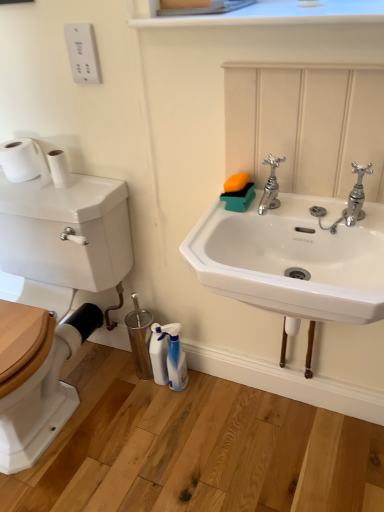
Locate an element on the screen. The width and height of the screenshot is (384, 512). white matte toilet paper at left, positioned as the second toilet paper in left-to-right order is located at coordinates (59, 168).

What do you see at coordinates (59, 168) in the screenshot? The width and height of the screenshot is (384, 512). I see `white matte toilet paper at left, the 1th toilet paper in the right-to-left sequence` at bounding box center [59, 168].

The width and height of the screenshot is (384, 512). What do you see at coordinates (175, 357) in the screenshot?
I see `white glossy spray bottle at lower center, the 1th cleaning product viewed from the right` at bounding box center [175, 357].

What do you see at coordinates (67, 233) in the screenshot? I see `white glossy toilet tank at left` at bounding box center [67, 233].

You are a GUI agent. You are given a task and a screenshot of the screen. Output one action in this format:
    pyautogui.click(x=<x>, y=<y>)
    Task: Click on the white glossy toilet tank at left
    The width and height of the screenshot is (384, 512).
    Given the screenshot: What is the action you would take?
    pyautogui.click(x=67, y=233)

This screenshot has width=384, height=512. What are the coordinates of `white matte toilet paper at left, positioned as the second toilet paper in left-to-right order` in the screenshot? It's located at (59, 168).

From the image's perspective, between white glossy toilet tank at left and chrome metallic faucet at upper right, which appears as the second tap when viewed from the left, which one is located above?

chrome metallic faucet at upper right, which appears as the second tap when viewed from the left, from the image's perspective.

Looking at this image, is white glossy toilet tank at left located outside chrome metallic faucet at upper right, which appears as the second tap when viewed from the left?

Absolutely, white glossy toilet tank at left is external to chrome metallic faucet at upper right, which appears as the second tap when viewed from the left.

Considering the positions of points (102, 251) and (360, 205), is point (102, 251) closer to camera compared to point (360, 205)?

No, (102, 251) is further to viewer.

This screenshot has height=512, width=384. Find the location of `the 1st tap above the white glossy toilet tank at left (from the image's perspective)`. the 1st tap above the white glossy toilet tank at left (from the image's perspective) is located at coordinates (x=354, y=198).

From the picture: Considering the sizes of objects chrome metallic faucet at upper center, the first tap when ordered from left to right, and chrome metallic faucet at upper right, which appears as the second tap when viewed from the left, in the image provided, who is smaller, chrome metallic faucet at upper center, the first tap when ordered from left to right, or chrome metallic faucet at upper right, which appears as the second tap when viewed from the left,?

With smaller size is chrome metallic faucet at upper right, which appears as the second tap when viewed from the left.

Which is closer to the camera, (276, 162) or (347, 214)?

Point (276, 162) is closer to the camera than point (347, 214).

This screenshot has width=384, height=512. I want to click on tap that appears in front of the chrome metallic faucet at upper center, the second tap viewed from the right, so click(x=354, y=198).

Is chrome metallic faucet at upper center, the second tap viewed from the right, next to chrome metallic faucet at upper right, which appears as the second tap when viewed from the left?

No, chrome metallic faucet at upper center, the second tap viewed from the right, is not beside chrome metallic faucet at upper right, which appears as the second tap when viewed from the left.

How much distance is there between white matte toilet paper at left, the 1th toilet paper viewed from the left, and white ceramic sink at center?

white matte toilet paper at left, the 1th toilet paper viewed from the left, and white ceramic sink at center are 32.39 inches apart.

What's the angular difference between white matte toilet paper at left, which is counted as the 2th toilet paper, starting from the right, and white ceramic sink at center's facing directions?

The facing directions of white matte toilet paper at left, which is counted as the 2th toilet paper, starting from the right, and white ceramic sink at center are 0.298 degrees apart.

From the image's perspective, which one is positioned higher, white matte toilet paper at left, the 1th toilet paper viewed from the left, or white ceramic sink at center?

From the image's view, white matte toilet paper at left, the 1th toilet paper viewed from the left, is above.

Image resolution: width=384 pixels, height=512 pixels. What are the coordinates of `sink in front of the white matte toilet paper at left, the 1th toilet paper viewed from the left` in the screenshot? It's located at (293, 257).

Which is behind, point (243, 17) or point (270, 234)?

The point (270, 234) is farther from the camera.

In terms of size, does white smooth window sill at upper center appear bigger or smaller than white ceramic sink at center?

Considering their sizes, white smooth window sill at upper center takes up less space than white ceramic sink at center.

In the scene shown: From a real-world perspective, is white smooth window sill at upper center on top of white ceramic sink at center?

Yes, from a real-world perspective, white smooth window sill at upper center is on top of white ceramic sink at center.

How many degrees apart are the facing directions of white glossy spray bottle at lower center, the 1th cleaning product viewed from the right, and white matte toilet paper at left, the 1th toilet paper in the right-to-left sequence?

There is a 46.4-degree angle between the facing directions of white glossy spray bottle at lower center, the 1th cleaning product viewed from the right, and white matte toilet paper at left, the 1th toilet paper in the right-to-left sequence.

Which of these two, white glossy spray bottle at lower center, which is the 2th cleaning product in left-to-right order, or white matte toilet paper at left, the 1th toilet paper in the right-to-left sequence, stands shorter?

With less height is white matte toilet paper at left, the 1th toilet paper in the right-to-left sequence.

You are a GUI agent. You are given a task and a screenshot of the screen. Output one action in this format:
    pyautogui.click(x=<x>, y=<y>)
    Task: Click on the 1st toilet paper above the white glossy spray bottle at lower center, which is the 2th cleaning product in left-to-right order (from the image's perspective)
    The width and height of the screenshot is (384, 512).
    Given the screenshot: What is the action you would take?
    pyautogui.click(x=59, y=168)

Is white glossy spray bottle at lower center, which is the 2th cleaning product in left-to-right order, aimed at white matte toilet paper at left, positioned as the second toilet paper in left-to-right order?

No, white glossy spray bottle at lower center, which is the 2th cleaning product in left-to-right order, is not facing towards white matte toilet paper at left, positioned as the second toilet paper in left-to-right order.

From a real-world perspective, is white matte toilet paper at left, positioned as the second toilet paper in left-to-right order, above or below white glossy toilet tank at left?

Clearly, from a real-world perspective, white matte toilet paper at left, positioned as the second toilet paper in left-to-right order, is above white glossy toilet tank at left.

Considering the sizes of objects white matte toilet paper at left, the 1th toilet paper in the right-to-left sequence, and white glossy toilet tank at left in the image provided, who is taller, white matte toilet paper at left, the 1th toilet paper in the right-to-left sequence, or white glossy toilet tank at left?

Standing taller between the two is white glossy toilet tank at left.

From the image's perspective, is white matte toilet paper at left, the 1th toilet paper in the right-to-left sequence, positioned above or below white glossy toilet tank at left?

Clearly, from the image's perspective, white matte toilet paper at left, the 1th toilet paper in the right-to-left sequence, is above white glossy toilet tank at left.

Considering the positions of objects white matte toilet paper at left, the 1th toilet paper in the right-to-left sequence, and white glossy toilet tank at left in the image provided, who is more to the right, white matte toilet paper at left, the 1th toilet paper in the right-to-left sequence, or white glossy toilet tank at left?

Positioned to the right is white matte toilet paper at left, the 1th toilet paper in the right-to-left sequence.

Considering the sizes of white smooth window sill at upper center and white matte toilet paper at left, positioned as the second toilet paper in left-to-right order, in the image, is white smooth window sill at upper center wider or thinner than white matte toilet paper at left, positioned as the second toilet paper in left-to-right order,?

Considering their sizes, white smooth window sill at upper center looks broader than white matte toilet paper at left, positioned as the second toilet paper in left-to-right order.

From a real-world perspective, relative to white matte toilet paper at left, positioned as the second toilet paper in left-to-right order, is white smooth window sill at upper center vertically above or below?

white smooth window sill at upper center is situated higher than white matte toilet paper at left, positioned as the second toilet paper in left-to-right order, in the real world.

Considering the relative positions of white smooth window sill at upper center and white matte toilet paper at left, the 1th toilet paper in the right-to-left sequence, in the image provided, is white smooth window sill at upper center to the left of white matte toilet paper at left, the 1th toilet paper in the right-to-left sequence, from the viewer's perspective?

In fact, white smooth window sill at upper center is to the right of white matte toilet paper at left, the 1th toilet paper in the right-to-left sequence.

Considering the points (157, 22) and (53, 157), which point is in front, point (157, 22) or point (53, 157)?

Point (157, 22)

This screenshot has height=512, width=384. What are the coordinates of `the 2nd tap counting from the right side of the white glossy toilet tank at left` in the screenshot? It's located at (354, 198).

The image size is (384, 512). What are the coordinates of `tap located in front of the chrome metallic faucet at upper center, the first tap when ordered from left to right` in the screenshot? It's located at (354, 198).

Considering their positions, is white glossy spray bottle at lower center, the 1th cleaning product viewed from the right, positioned further to chrome metallic faucet at upper center, the second tap viewed from the right, than white matte toilet paper at left, the 1th toilet paper in the right-to-left sequence?

white glossy spray bottle at lower center, the 1th cleaning product viewed from the right.

Based on their spatial positions, is white glossy spray bottle at lower center, which is the 2th cleaning product in left-to-right order, or white matte toilet paper at left, positioned as the second toilet paper in left-to-right order, closer to white ceramic sink at center?

Based on the image, white matte toilet paper at left, positioned as the second toilet paper in left-to-right order, appears to be nearer to white ceramic sink at center.

Estimate the real-world distances between objects in this image. Which object is further from chrome metallic faucet at upper center, the second tap viewed from the right, chrome metallic faucet at upper right, which appears as the second tap when viewed from the left, or white ceramic sink at center?

white ceramic sink at center is positioned further to the anchor chrome metallic faucet at upper center, the second tap viewed from the right.

From the image, which object appears to be farther from white smooth window sill at upper center, white matte toilet paper at left, the 1th toilet paper in the right-to-left sequence, or chrome metallic faucet at upper right, which ranks as the first tap in right-to-left order?

white matte toilet paper at left, the 1th toilet paper in the right-to-left sequence, lies further to white smooth window sill at upper center than the other object.

From the image, which object appears to be farther from white ceramic sink at center, white matte toilet paper at left, positioned as the second toilet paper in left-to-right order, or white plastic spray bottle at lower center, which ranks as the first cleaning product in left-to-right order?

Among the two, white plastic spray bottle at lower center, which ranks as the first cleaning product in left-to-right order, is located further to white ceramic sink at center.

When comparing their distances from white plastic spray bottle at lower center, arranged as the 2th cleaning product when viewed from the right, does white matte toilet paper at left, which is counted as the 2th toilet paper, starting from the right, or white ceramic sink at center seem further?

white ceramic sink at center is positioned further to the anchor white plastic spray bottle at lower center, arranged as the 2th cleaning product when viewed from the right.

Which object lies further to the anchor point chrome metallic faucet at upper center, the first tap when ordered from left to right, white matte toilet paper at left, positioned as the second toilet paper in left-to-right order, or white glossy spray bottle at lower center, the 1th cleaning product viewed from the right?

white glossy spray bottle at lower center, the 1th cleaning product viewed from the right, is positioned further to the anchor chrome metallic faucet at upper center, the first tap when ordered from left to right.

In the scene shown: When comparing their distances from white smooth window sill at upper center, does chrome metallic faucet at upper right, which appears as the second tap when viewed from the left, or white glossy toilet tank at left seem closer?

chrome metallic faucet at upper right, which appears as the second tap when viewed from the left, lies closer to white smooth window sill at upper center than the other object.

You are a GUI agent. You are given a task and a screenshot of the screen. Output one action in this format:
    pyautogui.click(x=<x>, y=<y>)
    Task: Click on the toilet paper between white matte toilet paper at left, which is counted as the 2th toilet paper, starting from the right, and white glossy spray bottle at lower center, the 1th cleaning product viewed from the right, in the vertical direction
    
    Given the screenshot: What is the action you would take?
    pyautogui.click(x=59, y=168)

The width and height of the screenshot is (384, 512). I want to click on wide between white matte toilet paper at left, the 1th toilet paper in the right-to-left sequence, and white glossy spray bottle at lower center, the 1th cleaning product viewed from the right, in the vertical direction, so click(x=67, y=233).

The height and width of the screenshot is (512, 384). I want to click on wide between white matte toilet paper at left, which is counted as the 2th toilet paper, starting from the right, and white glossy spray bottle at lower center, which is the 2th cleaning product in left-to-right order, in the vertical direction, so click(x=67, y=233).

Find the location of a particular element. This screenshot has width=384, height=512. tap between white glossy toilet tank at left and chrome metallic faucet at upper right, which appears as the second tap when viewed from the left, from left to right is located at coordinates (270, 186).